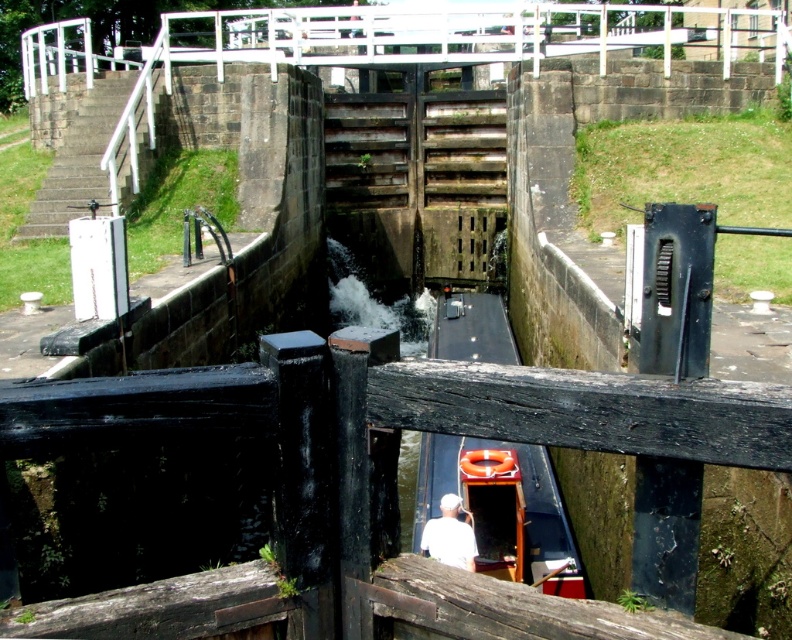
You are standing on the white railing of the canal lock and want to move the wooden boat at center closer to the white fabric at center. How much distance do you need to move it?

The wooden boat at center is currently 5.22 feet away from the white fabric at center, so you need to move it 5.22 feet closer.

You are standing at the point closest to the lock gates. Which of the two points, point (497,474) or point (459,564), is farther away from you?

Point (497,474) is farther away from you because it is behind point (459,564).